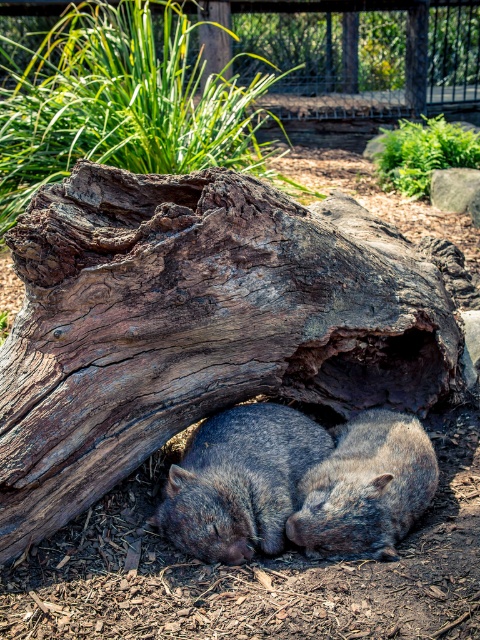
Question: Is fuzzy gray wombat at center in front of gray furry wombat at center?

Choices:
 (A) no
 (B) yes

Answer: (A)

Question: Among these points, which one is farthest from the camera?

Choices:
 (A) (283, 460)
 (B) (376, 531)
 (C) (273, 237)

Answer: (A)

Question: Among these points, which one is farthest from the camera?

Choices:
 (A) (158, 220)
 (B) (406, 442)

Answer: (B)

Question: Is gray rough bark tree trunk at center positioned behind gray furry wombat at center?

Choices:
 (A) yes
 (B) no

Answer: (B)

Question: Estimate the real-world distances between objects in this image. Which object is farther from the fuzzy gray wombat at center?

Choices:
 (A) gray rough bark tree trunk at center
 (B) gray furry wombat at center

Answer: (A)

Question: Can you confirm if gray rough bark tree trunk at center is wider than gray furry wombat at center?

Choices:
 (A) no
 (B) yes

Answer: (B)